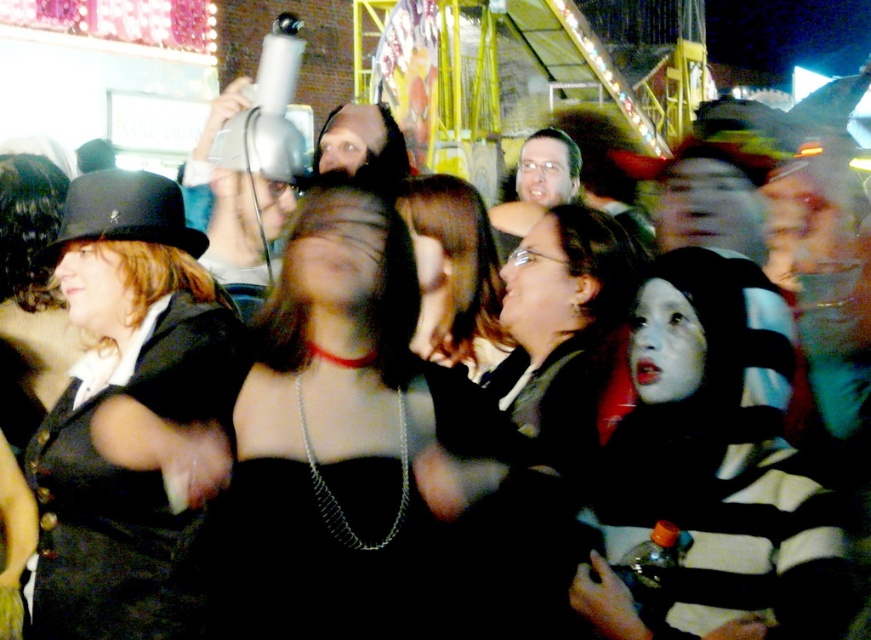
Question: Which is nearer to the black matte dress at center?

Choices:
 (A) matte black hat at left
 (B) matte black dress at center

Answer: (A)

Question: Can you confirm if striped fabric scarf at lower right is positioned below matte black hat at left?

Choices:
 (A) yes
 (B) no

Answer: (A)

Question: Among these points, which one is farthest from the camera?

Choices:
 (A) (84, 556)
 (B) (707, 326)
 (C) (448, 262)
 (D) (362, 456)

Answer: (C)

Question: Does striped fabric scarf at lower right come behind matte black hat at left?

Choices:
 (A) yes
 (B) no

Answer: (B)

Question: Which point is closer to the camera?

Choices:
 (A) (754, 426)
 (B) (439, 348)
 (C) (152, 259)

Answer: (A)

Question: Can you confirm if matte black hat at left is wider than matte black dress at center?

Choices:
 (A) yes
 (B) no

Answer: (A)